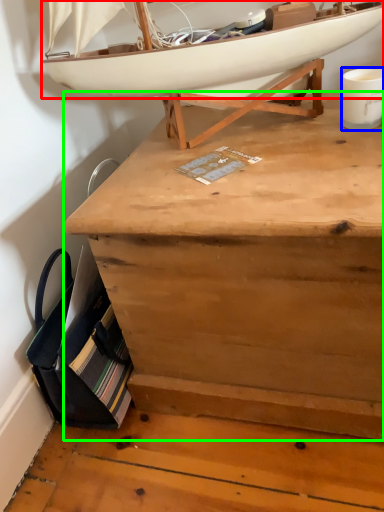
Question: Estimate the real-world distances between objects in this image. Which object is closer to boat (highlighted by a red box), coffee cup (highlighted by a blue box) or desk (highlighted by a green box)?

Choices:
 (A) coffee cup
 (B) desk

Answer: (A)